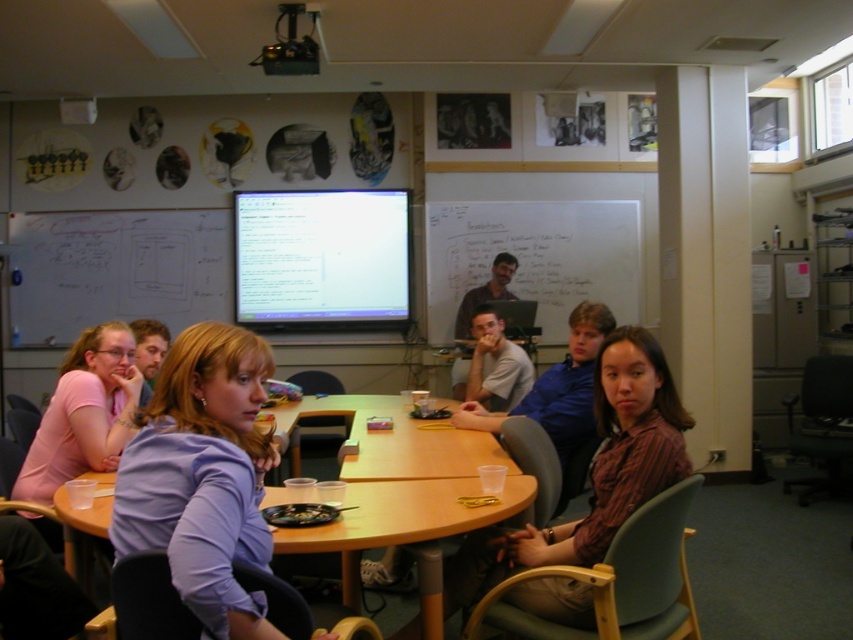
Question: Considering the real-world distances, which object is farthest from the whiteboard at center?

Choices:
 (A) pink matte shirt at lower left
 (B) matte brown shirt at center
 (C) striped cotton shirt at center

Answer: (C)

Question: Does striped cotton shirt at center have a lesser width compared to matte brown shirt at center?

Choices:
 (A) no
 (B) yes

Answer: (A)

Question: Which point appears closest to the camera in this image?

Choices:
 (A) (479, 518)
 (B) (601, 244)
 (C) (194, 600)

Answer: (C)

Question: Can you confirm if whiteboard at center is positioned above matte brown shirt at center?

Choices:
 (A) yes
 (B) no

Answer: (A)

Question: Which object appears farthest from the camera in this image?

Choices:
 (A) pink matte shirt at lower left
 (B) matte brown shirt at center
 (C) striped cotton shirt at center

Answer: (B)

Question: Is striped cotton shirt at center to the left of pink matte shirt at lower left from the viewer's perspective?

Choices:
 (A) no
 (B) yes

Answer: (A)